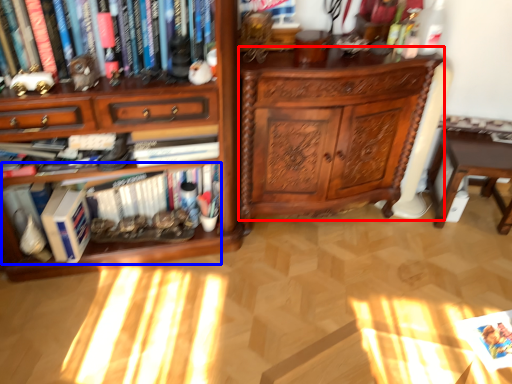
Question: Which point is further to the camera, chest of drawers (highlighted by a red box) or book (highlighted by a blue box)?

Choices:
 (A) chest of drawers
 (B) book

Answer: (B)